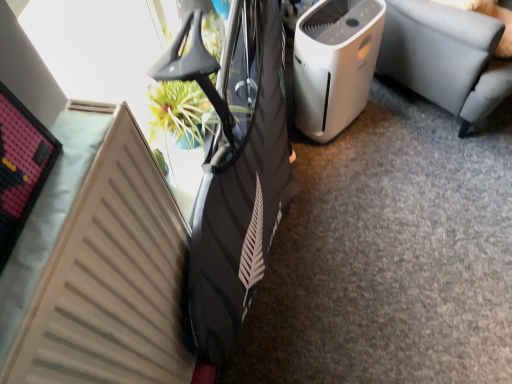
Question: Is beige matte radiator at lower left taller or shorter than white plastic air purifier at center-right?

Choices:
 (A) tall
 (B) short

Answer: (A)

Question: From a real-world perspective, is beige matte radiator at lower left positioned above or below white plastic air purifier at center-right?

Choices:
 (A) above
 (B) below

Answer: (A)

Question: Which of these objects is positioned closest to the beige matte radiator at lower left?

Choices:
 (A) white plastic air purifier at center-right
 (B) white plastic air purifier at center right

Answer: (A)

Question: Which object is positioned farthest from the white plastic air purifier at center-right?

Choices:
 (A) white plastic air purifier at center right
 (B) beige matte radiator at lower left

Answer: (B)